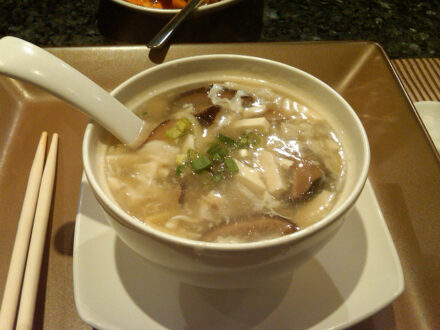
This screenshot has width=440, height=330. Identify the location of rim of bowl. (217, 52), (106, 200).